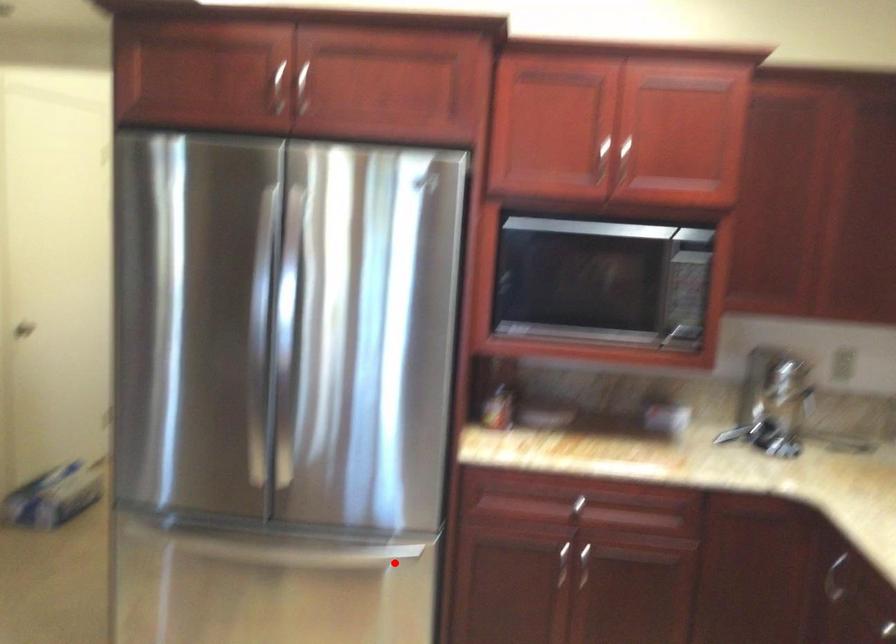
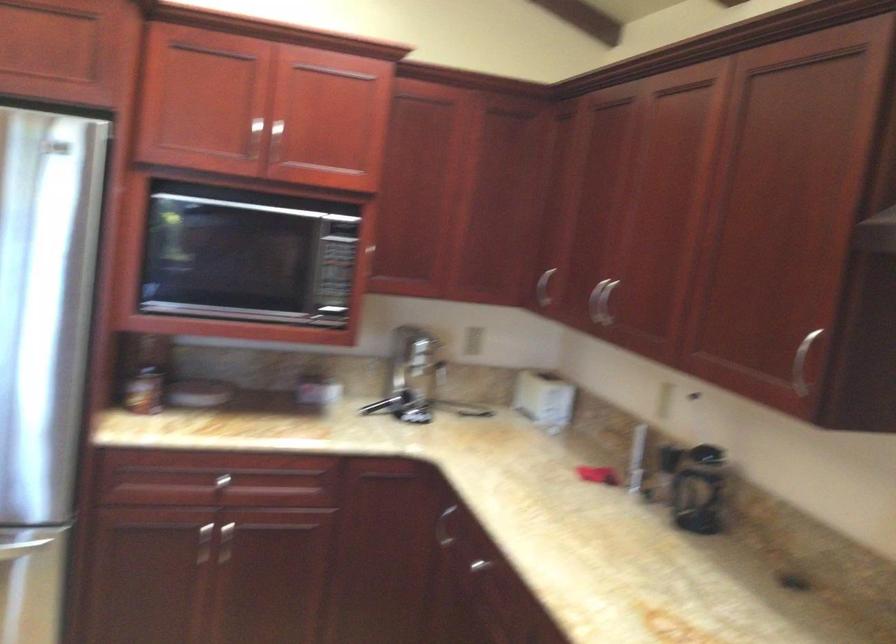
Locate, in the second image, the point that corresponds to the highlighted location in the first image.

(21, 547)